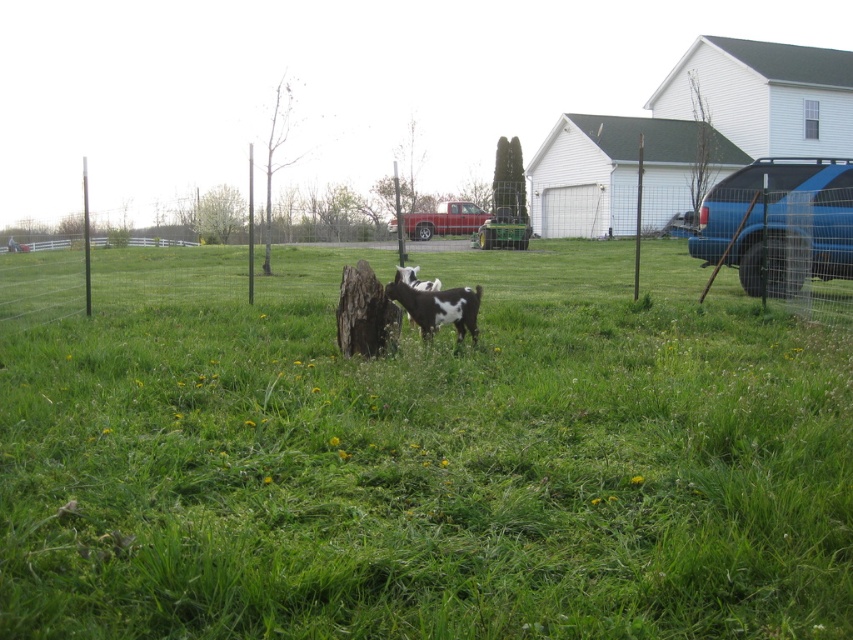
Question: Which point is closer to the camera taking this photo?

Choices:
 (A) (457, 332)
 (B) (624, 605)

Answer: (B)

Question: Can you confirm if green grassy at center is thinner than white-spotted fur goat at center?

Choices:
 (A) yes
 (B) no

Answer: (B)

Question: Is green grassy at center below white-spotted fur goat at center?

Choices:
 (A) yes
 (B) no

Answer: (B)

Question: Does green grassy at center have a lesser width compared to white-spotted fur goat at center?

Choices:
 (A) yes
 (B) no

Answer: (B)